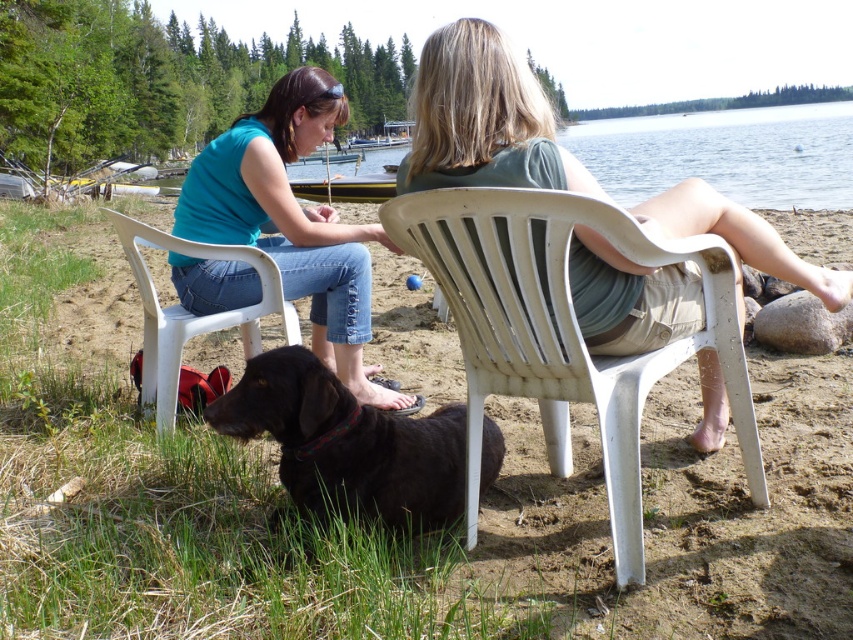
You are standing at the center of the image and want to locate the green fabric shirt at center. Which direction should you look to find it?

The green fabric shirt at center is located at point (483,120), so you should look to the left and slightly downward from the center to find it.

You are a photographer wanting to capture a photo of both the brown fur dog at center and the shiny black dog at lower center. Since you want them both in the frame, which direction should you move your camera to include both dogs?

The brown fur dog at center is to the left of the shiny black dog at lower center. To include both in the frame, move the camera to the right to capture the brown fur dog at center and left to capture the shiny black dog at lower center. However, since they are positioned left and right relative to each other, centering the camera between them would ensure both are in the frame.